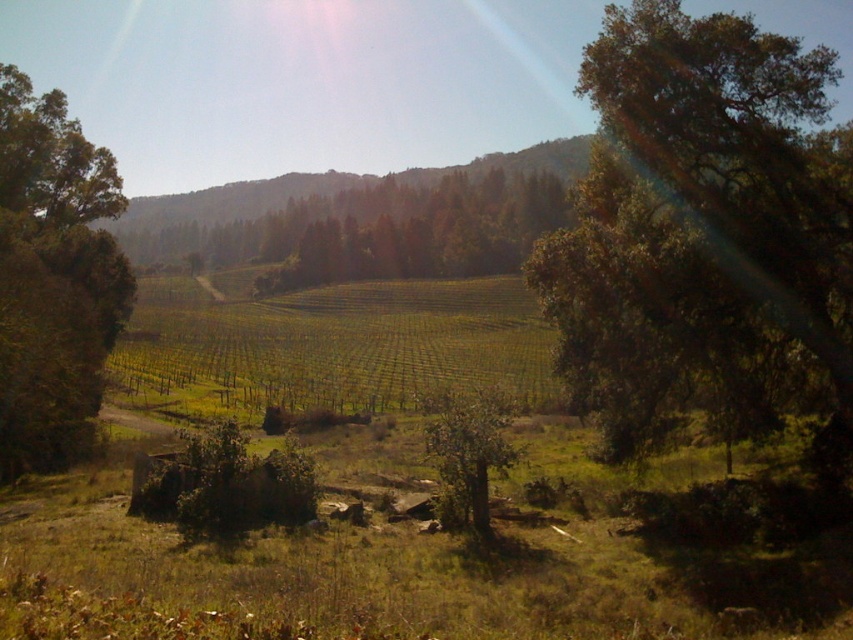
Question: Which object is the closest to the green matte tree at center?

Choices:
 (A) green leafy tree at left
 (B) green leafy tree at upper right

Answer: (A)

Question: Which of the following is the farthest from the observer?

Choices:
 (A) green leafy tree at upper right
 (B) green grassy field at center
 (C) green matte tree at center

Answer: (C)

Question: Can you confirm if green grassy field at center is positioned above green leafy tree at left?

Choices:
 (A) no
 (B) yes

Answer: (A)

Question: Does green matte tree at center have a greater width compared to green leafy tree at center?

Choices:
 (A) yes
 (B) no

Answer: (A)

Question: Considering the real-world distances, which object is farthest from the green leafy tree at center?

Choices:
 (A) green matte tree at center
 (B) green leafy tree at left
 (C) green leafy tree at upper right

Answer: (A)

Question: Does green leafy tree at upper right have a greater width compared to green leafy tree at left?

Choices:
 (A) yes
 (B) no

Answer: (A)